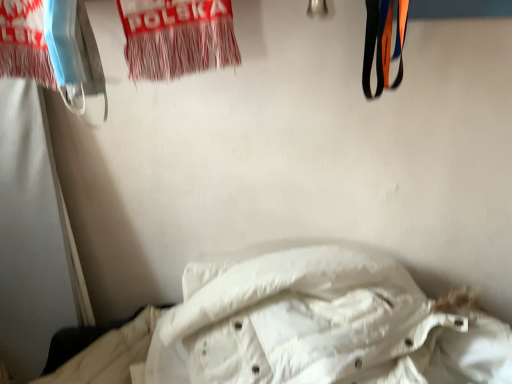
Find the location of a particular element. white down comforter at lower center is located at coordinates (301, 328).

What is the approximate height of white down comforter at lower center?

white down comforter at lower center is 27.94 inches tall.

The width and height of the screenshot is (512, 384). What do you see at coordinates (301, 328) in the screenshot? I see `white down comforter at lower center` at bounding box center [301, 328].

The height and width of the screenshot is (384, 512). I want to click on white down comforter at lower center, so click(x=301, y=328).